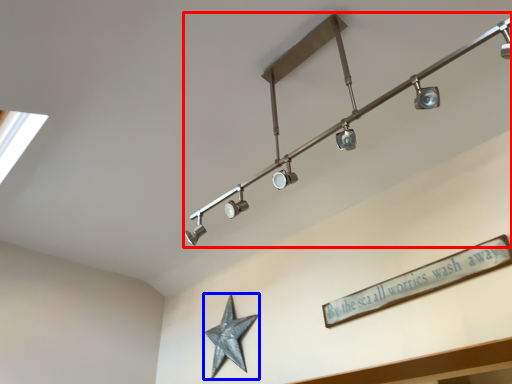
Question: Which point is further to the camera, lamp (highlighted by a red box) or star (highlighted by a blue box)?

Choices:
 (A) lamp
 (B) star

Answer: (B)